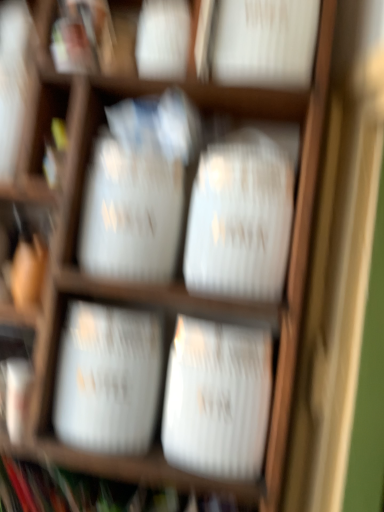
Question: Is point (74, 301) positioned closer to the camera than point (221, 281)?

Choices:
 (A) farther
 (B) closer

Answer: (A)

Question: From their relative heights in the image, would you say white glossy vase at center, which is the 2th wide from bottom to top, is taller or shorter than white paper bag at center, which ranks as the 1th wide in top-to-bottom order?

Choices:
 (A) short
 (B) tall

Answer: (A)

Question: Considering the real-world distances, which object is closest to the white glossy vase at center, which is the 2th wide from bottom to top?

Choices:
 (A) white paper bag at center, the third wide from the bottom
 (B) white glossy vase at center, which is the 3th wide in top-to-bottom order

Answer: (B)

Question: Which of these objects is positioned closest to the white glossy vase at center, which ranks as the second wide in top-to-bottom order?

Choices:
 (A) white paper bag at center, which ranks as the 1th wide in top-to-bottom order
 (B) white glossy vase at center, acting as the first wide starting from the bottom

Answer: (B)